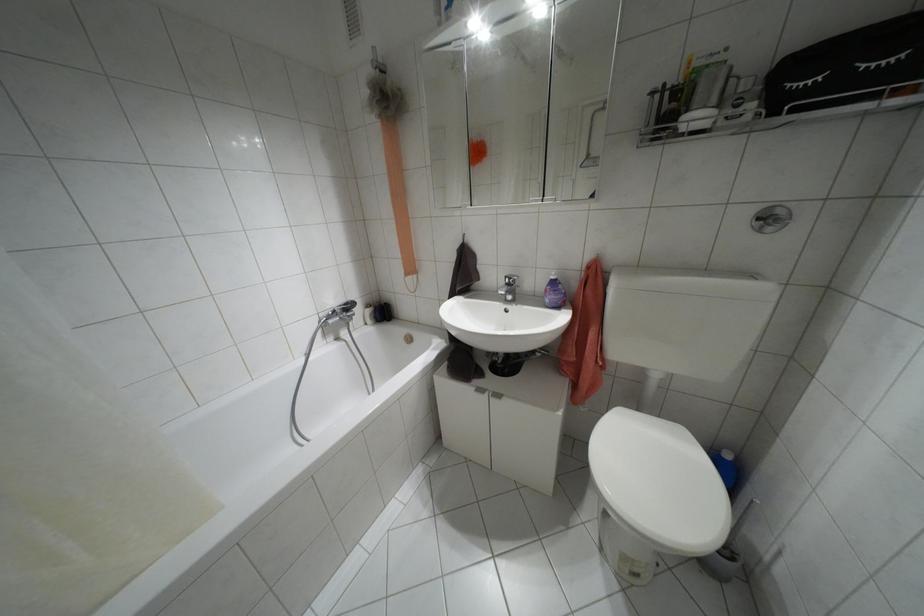
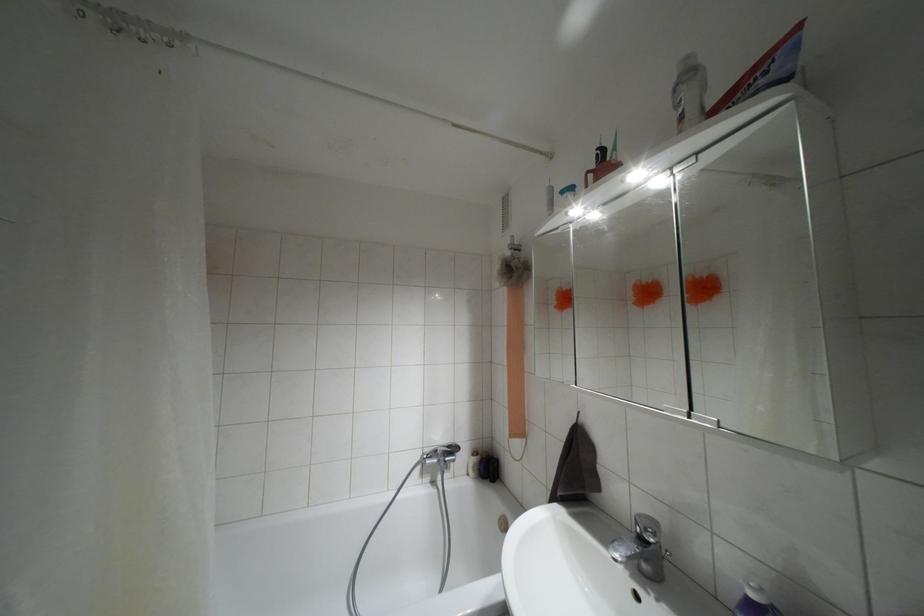
The point at (507,284) is marked in the first image. Where is the corresponding point in the second image?

(641, 538)